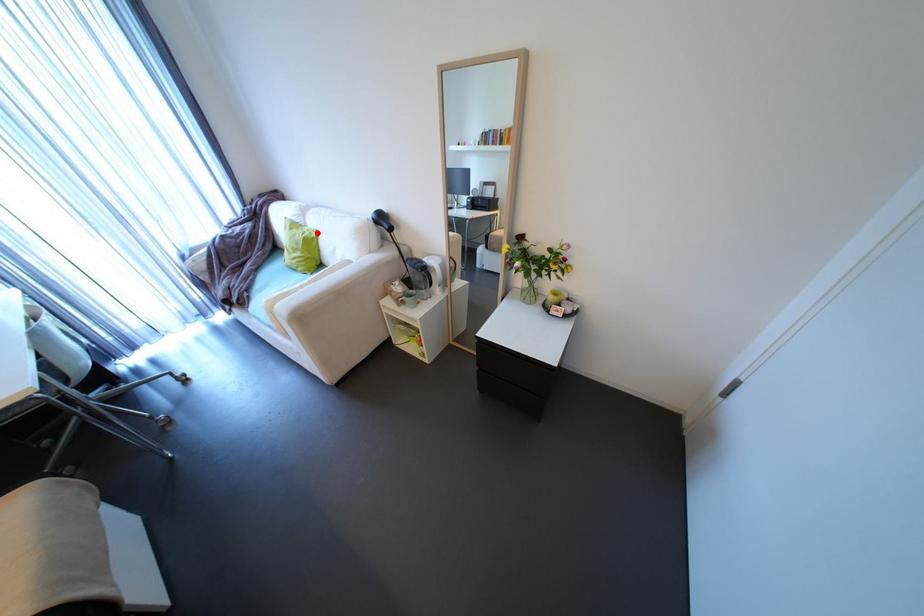
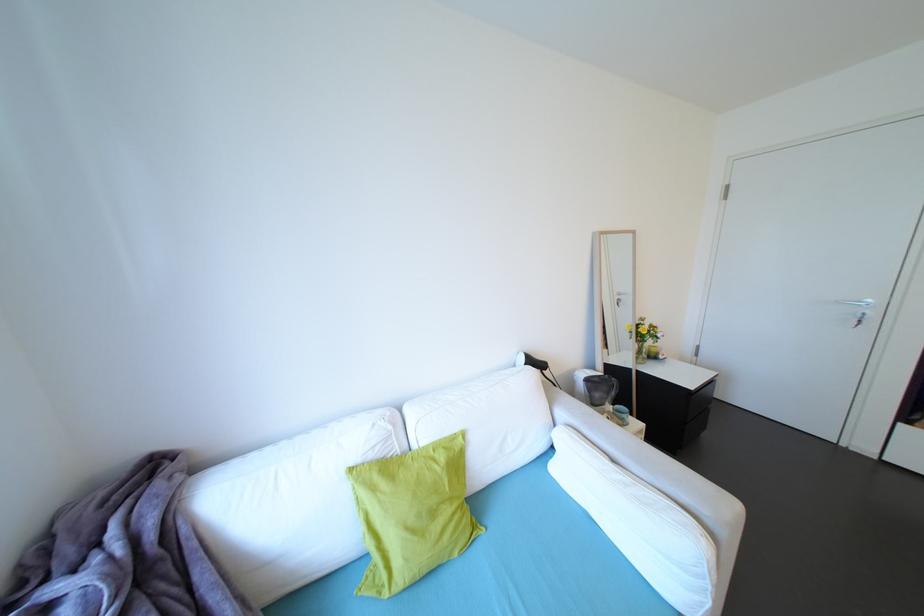
Find the pixel in the second image that matches the highlighted location in the first image.

(451, 448)